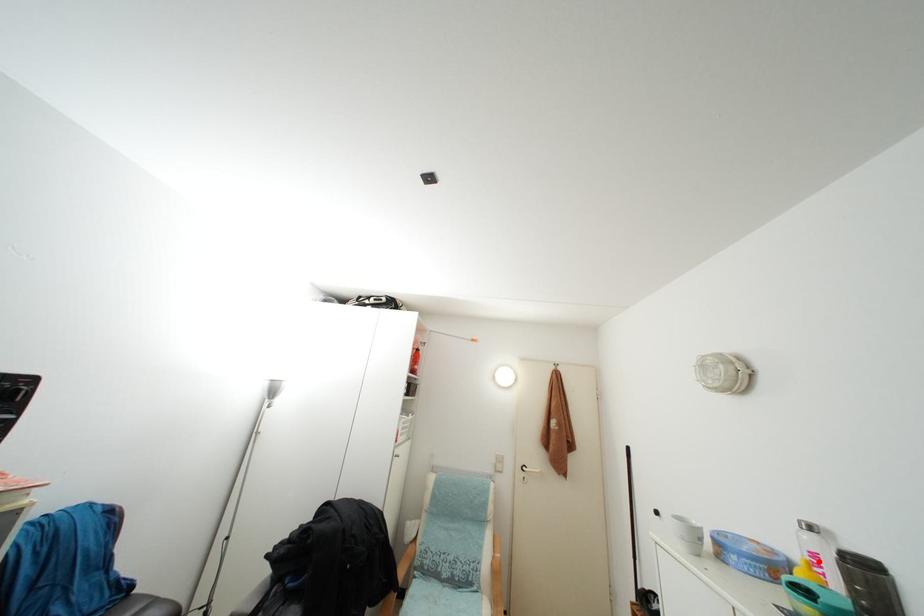
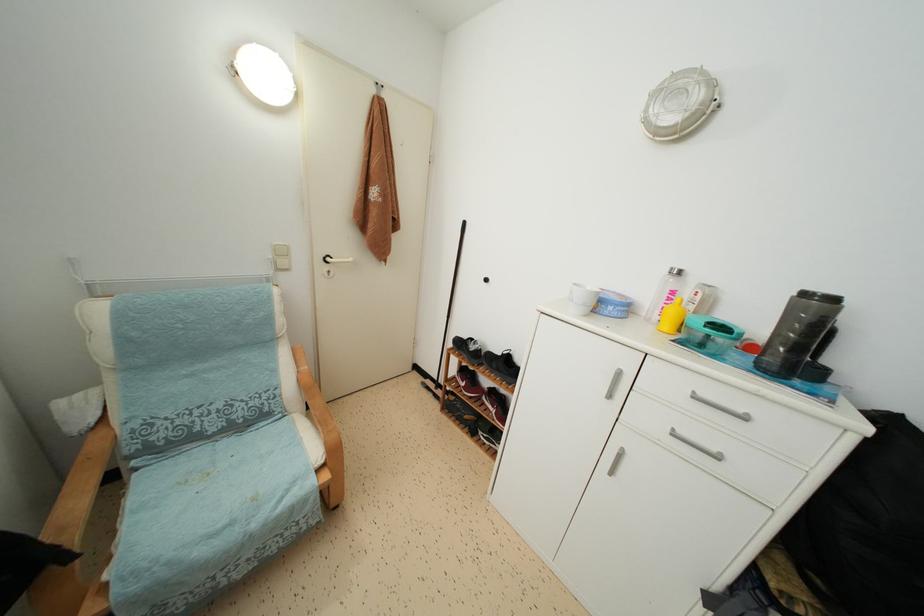
The point at the highlighted location is marked in the first image. Where is the corresponding point in the second image?

(676, 299)